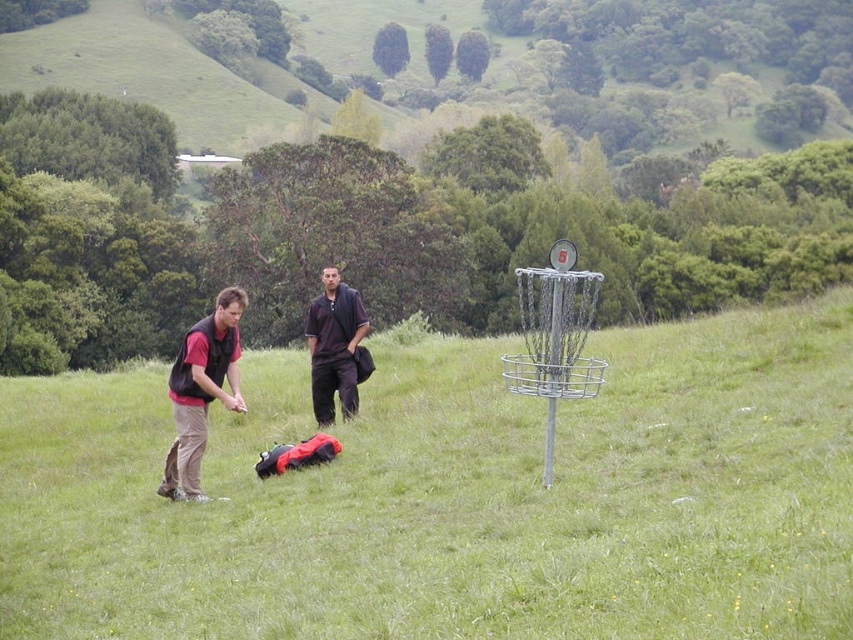
Can you confirm if green grassy field at center is positioned to the right of dark matte shirt at center?

Correct, you'll find green grassy field at center to the right of dark matte shirt at center.

Is point (705, 426) farther from viewer compared to point (350, 307)?

No, (705, 426) is in front of (350, 307).

Between point (828, 515) and point (321, 317), which one is positioned behind?

The point (321, 317) is behind.

At what (x,y) coordinates should I click in order to perform the action: click on green grassy field at center. Please return your answer as a coordinate pair (x, y). Looking at the image, I should click on (453, 497).

Does brushed metal vest at left have a smaller size compared to dark matte shirt at center?

Actually, brushed metal vest at left might be larger than dark matte shirt at center.

Who is more forward, (209, 333) or (343, 308)?

Point (209, 333)

I want to click on brushed metal vest at left, so click(201, 390).

Who is more forward, (215, 381) or (196, 444)?

Point (196, 444) is in front.

Is point (345, 390) positioned behind point (178, 349)?

No.

Which is behind, point (357, 301) or point (190, 497)?

The point (357, 301) is behind.

Locate an element on the screen. The image size is (853, 640). matte black vest at left is located at coordinates (202, 390).